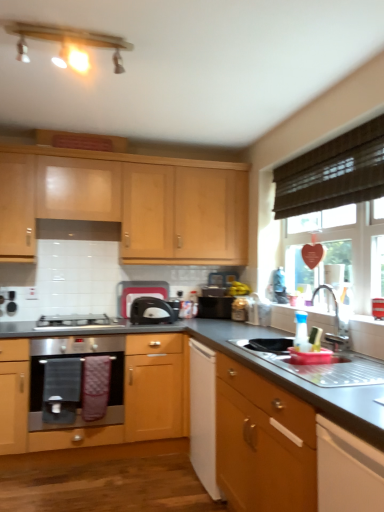
Where is `vacant point above matte wood light fixture at upper center (from a real-world perspective)`? The image size is (384, 512). vacant point above matte wood light fixture at upper center (from a real-world perspective) is located at coordinates (66, 31).